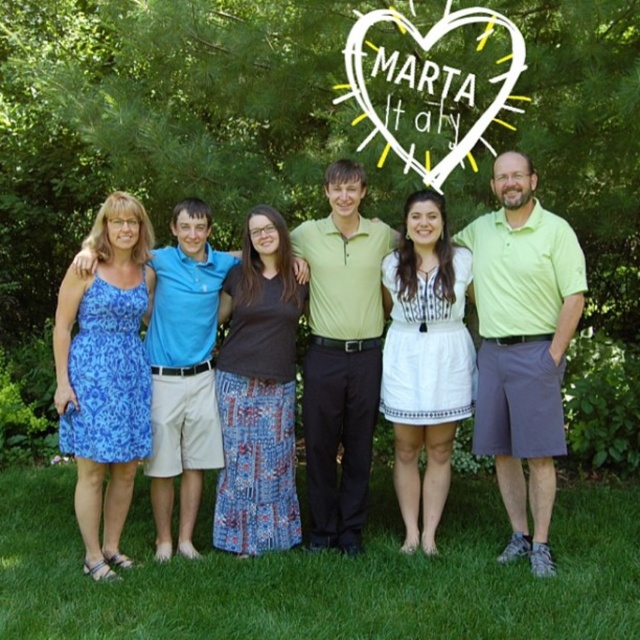
Question: Which object is positioned farthest from the blue printed dress at left?

Choices:
 (A) blue cotton shorts at left
 (B) dark brown cotton shirt at center
 (C) lime green polo shirt at center
 (D) blue floral dress at left

Answer: (D)

Question: Estimate the real-world distances between objects in this image. Which object is closer to the blue floral dress at left?

Choices:
 (A) green leafy tree at center
 (B) white cotton dress at center
 (C) blue cotton shorts at left

Answer: (C)

Question: Is green grass at lower center positioned at the back of blue floral dress at left?

Choices:
 (A) no
 (B) yes

Answer: (A)

Question: Which point is closer to the camera?

Choices:
 (A) (145, 234)
 (B) (536, 552)
 (C) (324, 108)
 (D) (262, 392)

Answer: (B)

Question: Can you confirm if green grass at lower center is positioned to the right of white cotton dress at center?

Choices:
 (A) yes
 (B) no

Answer: (B)

Question: Is blue printed dress at left to the right of blue floral dress at left from the viewer's perspective?

Choices:
 (A) yes
 (B) no

Answer: (A)